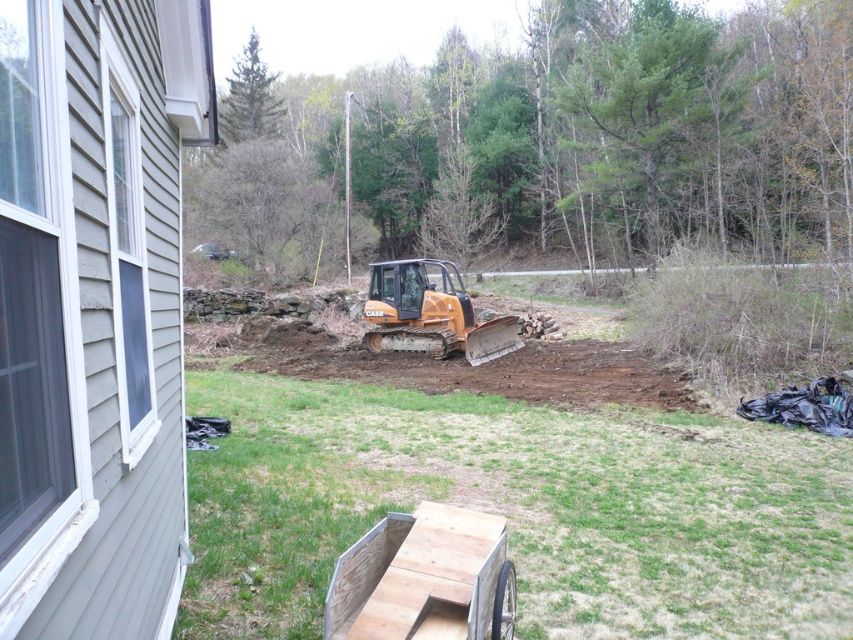
Looking at this image, you are a construction worker who needs to determine which piece of equipment is taller between the orange compact tractor at center and the orange rubber plow at center. Based on the scene, which one is taller?

The orange compact tractor at center is much taller than the orange rubber plow at center according to the description.

You are standing at the point marked as point (519, 508). What object are you on?

The point (519, 508) is on the orange compact tractor at center.